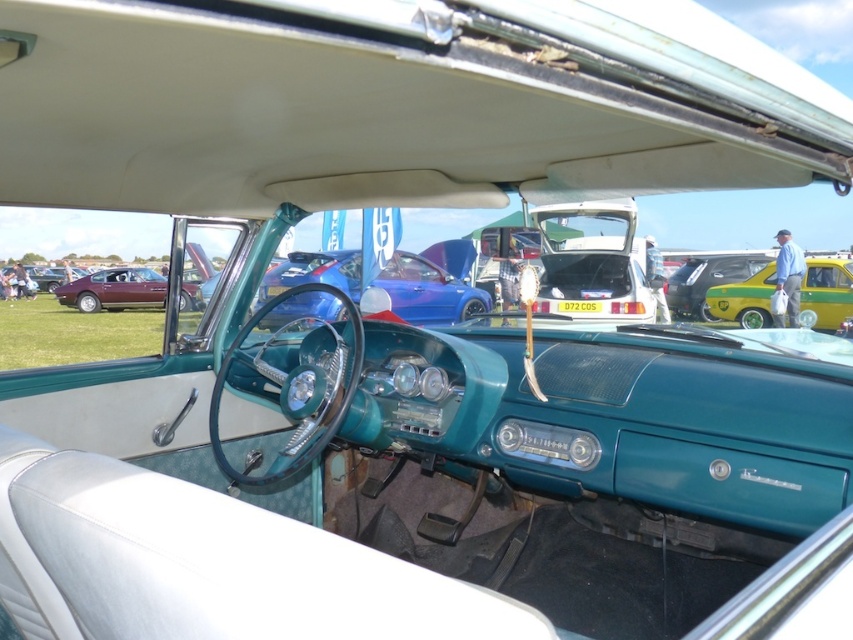
Question: Which point is closer to the camera taking this photo?

Choices:
 (A) (737, 284)
 (B) (303, 266)
 (C) (112, 300)

Answer: (B)

Question: Which is nearer to the yellow matte car at right?

Choices:
 (A) yellow-green metallic hatchback at center-right
 (B) shiny maroon car at left
 (C) blue metallic steering wheel at center

Answer: (A)

Question: Which point is farther to the camera?

Choices:
 (A) (677, 269)
 (B) (351, 298)

Answer: (A)

Question: Is shiny maroon car at left thinner than yellow-green metallic hatchback at center-right?

Choices:
 (A) no
 (B) yes

Answer: (A)

Question: Does blue metallic steering wheel at center have a lesser width compared to yellow matte car at right?

Choices:
 (A) no
 (B) yes

Answer: (B)

Question: In this image, where is blue metallic steering wheel at center located relative to yellow matte car at right?

Choices:
 (A) above
 (B) below

Answer: (B)